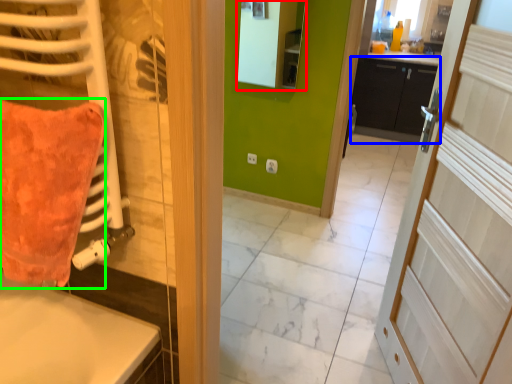
Question: Which object is positioned closest to mirror (highlighted by a red box)? Select from cabinetry (highlighted by a blue box) and throw pillow (highlighted by a green box).

Choices:
 (A) cabinetry
 (B) throw pillow

Answer: (A)